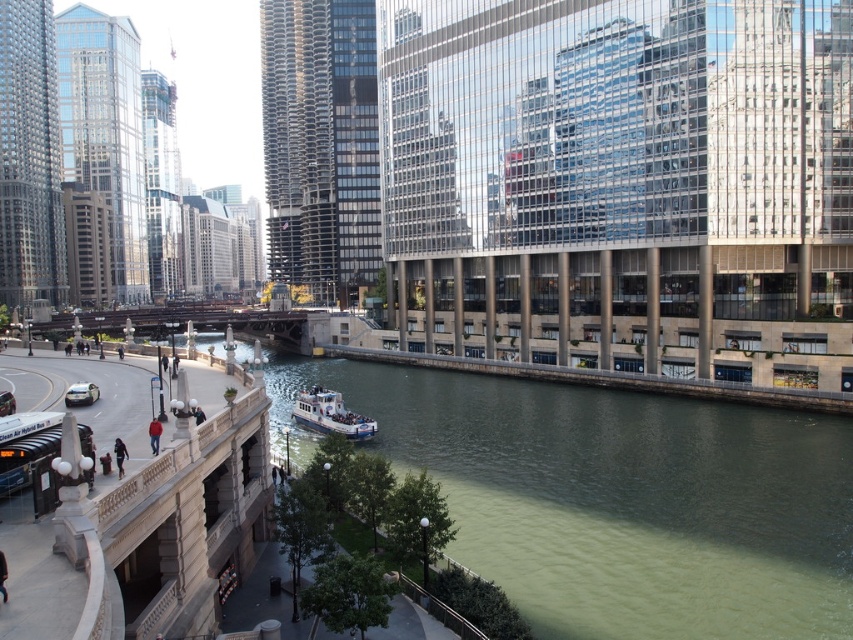
Question: Which of the following is the closest to the observer?

Choices:
 (A) white glossy boat at center
 (B) matte black car at lower left

Answer: (B)

Question: Which point is farther from the camera taking this photo?

Choices:
 (A) (85, 384)
 (B) (363, 424)
 (C) (431, 416)

Answer: (C)

Question: Does white glossy boat at center have a lesser width compared to matte black car at lower left?

Choices:
 (A) no
 (B) yes

Answer: (A)

Question: Considering the relative positions of greenish water at center and white glossy boat at center in the image provided, where is greenish water at center located with respect to white glossy boat at center?

Choices:
 (A) below
 (B) above

Answer: (A)

Question: Which object is farther from the camera taking this photo?

Choices:
 (A) greenish water at center
 (B) matte black car at lower left

Answer: (B)

Question: From the image, what is the correct spatial relationship of white glossy boat at center in relation to matte black car at lower left?

Choices:
 (A) right
 (B) left

Answer: (A)